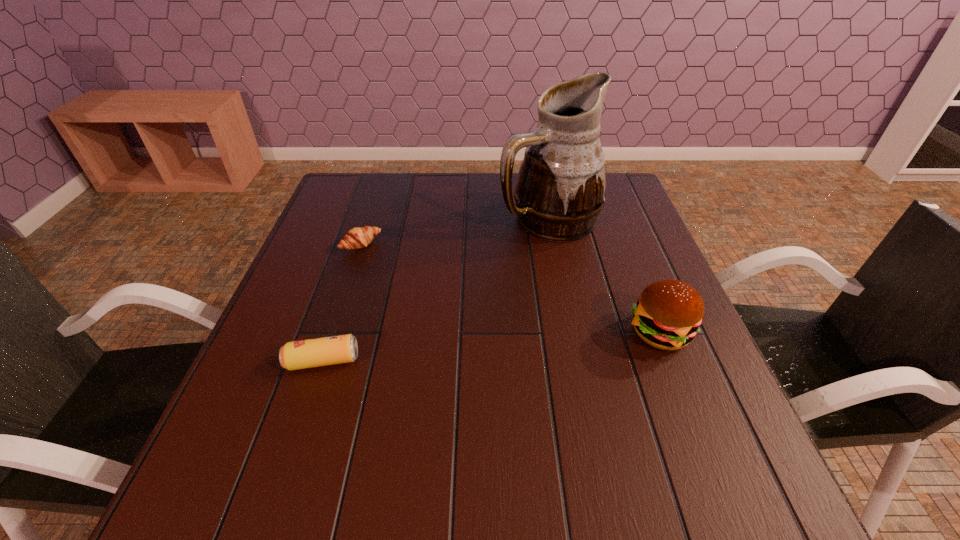
In the image, there is a desktop. At what (x,y) coordinates should I click in order to perform the action: click on free space at the left edge. Please return your answer as a coordinate pair (x, y). The width and height of the screenshot is (960, 540). Looking at the image, I should click on (276, 356).

In the image, there is a desktop. Where is `blank space at the right edge`? blank space at the right edge is located at coordinates (654, 282).

In order to click on free spot at the far left corner of the desktop in this screenshot , I will do [x=375, y=195].

What are the coordinates of `vacant space at the near left corner` in the screenshot? It's located at (228, 441).

Find the location of a particular element. The height and width of the screenshot is (540, 960). vacant region between the tallest object and the beer can is located at coordinates (436, 290).

The height and width of the screenshot is (540, 960). I want to click on empty space that is in between the hamburger and the tallest object, so click(x=604, y=276).

Find the location of a particular element. The height and width of the screenshot is (540, 960). free spot between the pitcher and the shortest object is located at coordinates (454, 232).

I want to click on unoccupied position between the shortest object and the beer can, so click(342, 302).

Find the location of a particular element. unoccupied area between the pastry and the beer can is located at coordinates (342, 302).

Find the location of a particular element. The width and height of the screenshot is (960, 540). free space that is in between the pitcher and the hamburger is located at coordinates (604, 276).